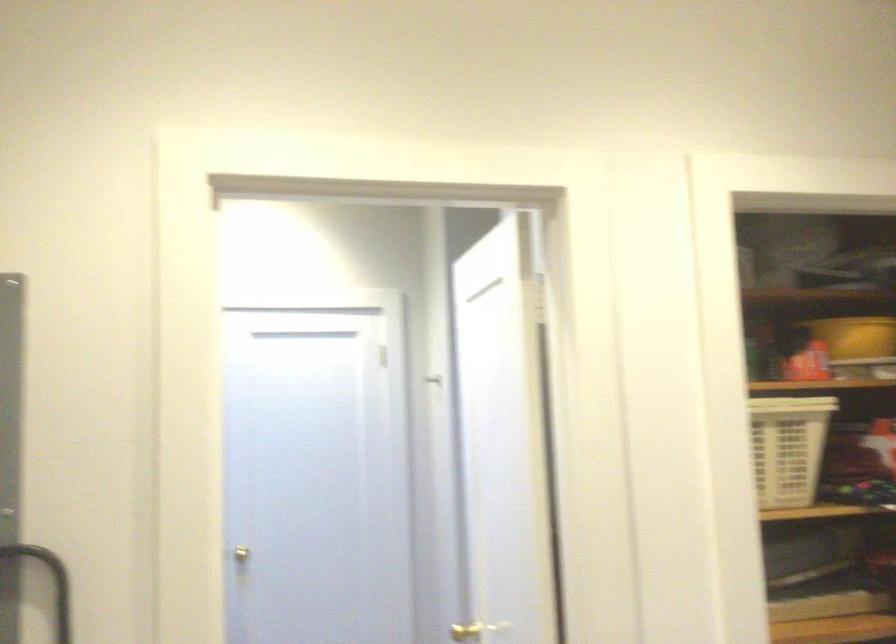
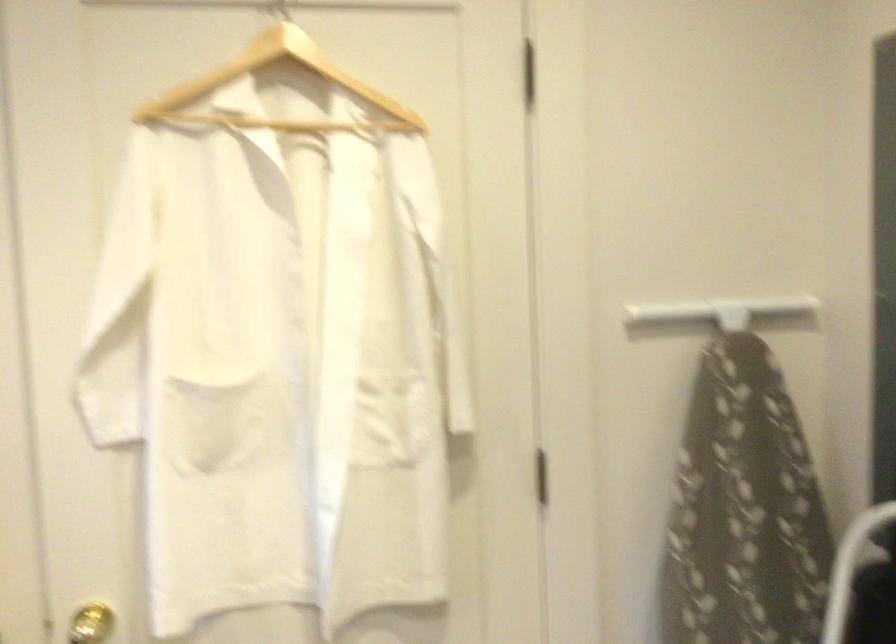
Question: The first image is from the beginning of the video and the second image is from the end. How did the camera likely rotate when shooting the video?

Choices:
 (A) Left
 (B) Right
 (C) Up
 (D) Down

Answer: (A)